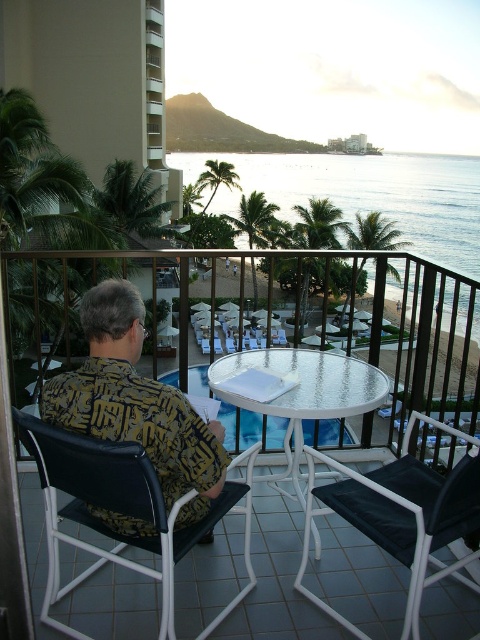
Is white metal table at center bigger than blue water at center?

No, white metal table at center is not bigger than blue water at center.

The width and height of the screenshot is (480, 640). What do you see at coordinates (375, 342) in the screenshot?
I see `white metal table at center` at bounding box center [375, 342].

Between point (277, 346) and point (267, 170), which one is positioned in front?

Point (277, 346)

The height and width of the screenshot is (640, 480). I want to click on white metal table at center, so click(x=375, y=342).

Does beige concrete balcony at left come in front of yellow printed shirt at center?

No, beige concrete balcony at left is further to the viewer.

Can you confirm if beige concrete balcony at left is bigger than yellow printed shirt at center?

Indeed, beige concrete balcony at left has a larger size compared to yellow printed shirt at center.

Is point (118, 99) in front of point (220, 461)?

That is False.

The image size is (480, 640). Identify the location of beige concrete balcony at left. (95, 80).

How distant is beige concrete balcony at left from blue water at center?

The distance of beige concrete balcony at left from blue water at center is 101.46 feet.

Which is below, beige concrete balcony at left or blue water at center?

Positioned lower is beige concrete balcony at left.

Who is more distant from viewer, [90,168] or [296,154]?

The point [296,154] is behind.

Identify the location of beige concrete balcony at left. The height and width of the screenshot is (640, 480). (95, 80).